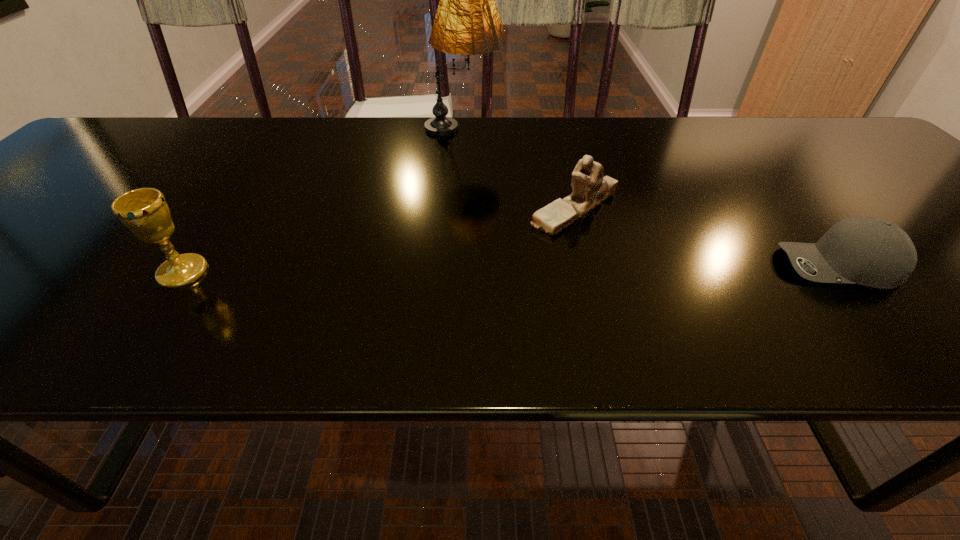
This screenshot has width=960, height=540. I want to click on free space located on the front-facing side of the second object from right to left, so click(445, 208).

At what (x,y) coordinates should I click in order to perform the action: click on vacant region located 0.320m on the front-facing side of the second object from right to left. Please return your answer as a coordinate pair (x, y). This screenshot has height=540, width=960. Looking at the image, I should click on (382, 208).

Identify the location of vacant position located 0.370m on the front-facing side of the second object from right to left. (359, 208).

Find the location of `free space located 0.180m on the front brim of the baseball cap`. free space located 0.180m on the front brim of the baseball cap is located at coordinates (686, 266).

Where is `vacant region located on the front brim of the baseball cap`? vacant region located on the front brim of the baseball cap is located at coordinates (756, 266).

Find the location of a particular element. vacant region located on the front brim of the baseball cap is located at coordinates (676, 266).

Where is `object that is positioned at the far edge`? This screenshot has height=540, width=960. object that is positioned at the far edge is located at coordinates (467, 22).

You are a GUI agent. You are given a task and a screenshot of the screen. Output one action in this format:
    pyautogui.click(x=<x>, y=<y>)
    Task: Click on the blank space at the far edge of the desktop
    The height and width of the screenshot is (540, 960).
    Given the screenshot: What is the action you would take?
    pyautogui.click(x=705, y=148)

Image resolution: width=960 pixels, height=540 pixels. What are the coordinates of `free space at the near edge of the desktop` in the screenshot? It's located at (278, 354).

Find the location of a particular element. free location at the far right corner is located at coordinates (820, 125).